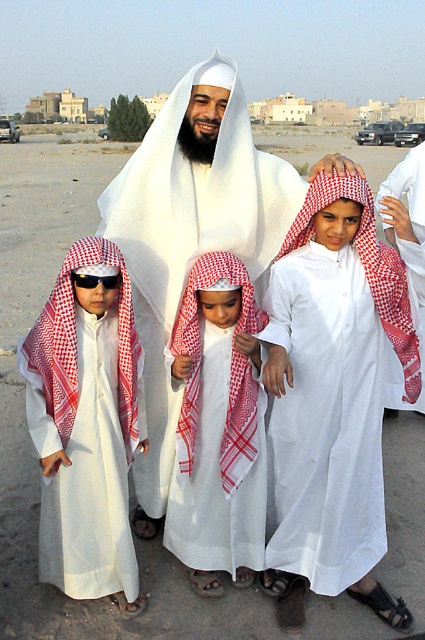
You are a photographer trying to capture a clear photo of the black plastic sunglasses at center without the white cotton robe at center blocking it. Given their sizes, can you suggest a way to frame the shot so the sunglasses are fully visible?

The white cotton robe at center is wider than the black plastic sunglasses at center. To ensure the sunglasses are fully visible, you can zoom in or adjust your angle to focus solely on the sunglasses while excluding the robe from the frame.

You are standing at the origin point in the desert scene. There are two points marked in the image. Which point is closer to you, point [146,218] or point [393,241]?

Point [393,241] is closer to you because it is in front of point [146,218].

Consider the image. You are taking a photo of the scene and want to focus on the two points labeled as point (183,312) and point (413,179). Which point should you adjust your camera focus to ensure the closer one is sharp?

Point (183,312) is closer to the camera than point (413,179), so you should focus on point (183,312) to ensure the closer one is sharp.